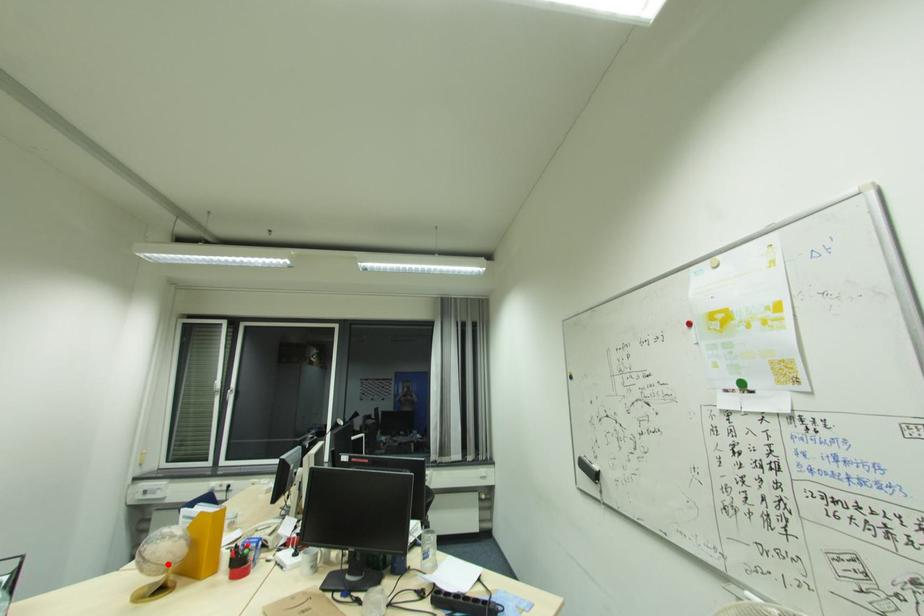
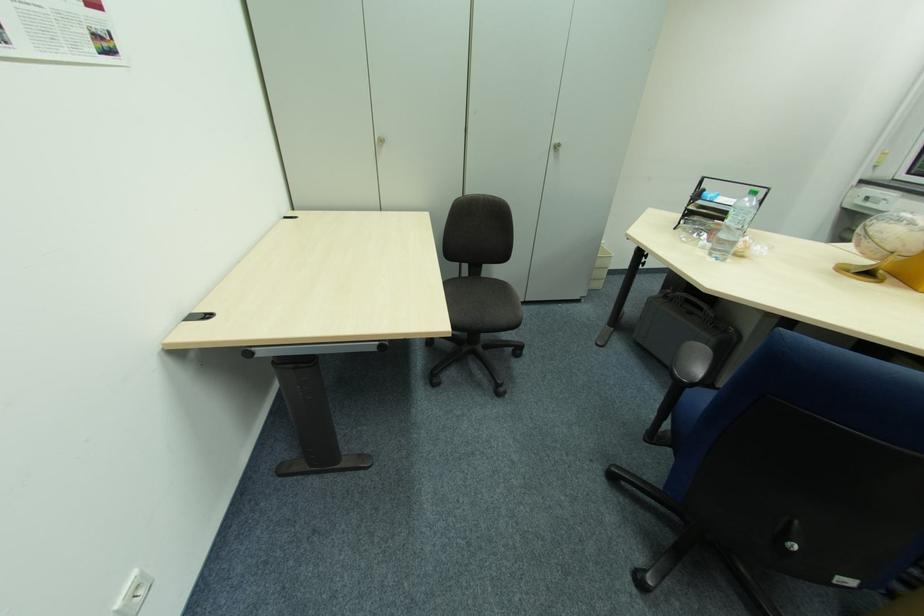
In the second image, find the point that corresponds to the highlighted location in the first image.

(893, 249)